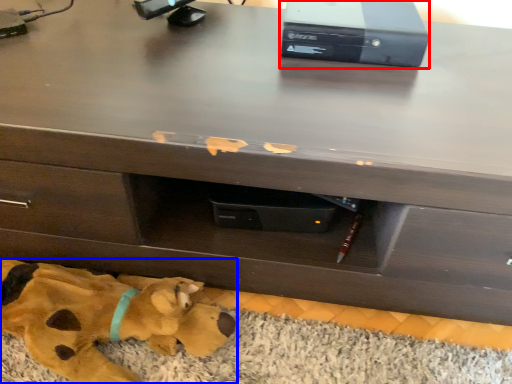
Question: Among these objects, which one is farthest to the camera, computer (highlighted by a red box) or toy (highlighted by a blue box)?

Choices:
 (A) computer
 (B) toy

Answer: (A)